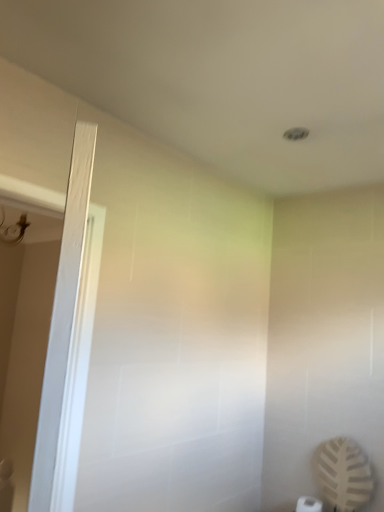
Question: Do you think white wood screen door at left is within white matte toilet paper at lower right, or outside of it?

Choices:
 (A) inside
 (B) outside

Answer: (B)

Question: Does point (44, 486) appear closer or farther from the camera than point (314, 499)?

Choices:
 (A) farther
 (B) closer

Answer: (B)

Question: Is white wood screen door at left taller or shorter than white matte toilet paper at lower right?

Choices:
 (A) tall
 (B) short

Answer: (A)

Question: Is white matte toilet paper at lower right to the left or to the right of white wood screen door at left in the image?

Choices:
 (A) right
 (B) left

Answer: (A)

Question: From a real-world perspective, is white matte toilet paper at lower right positioned above or below white wood screen door at left?

Choices:
 (A) below
 (B) above

Answer: (A)

Question: Considering the positions of point (311, 509) and point (64, 385), is point (311, 509) closer or farther from the camera than point (64, 385)?

Choices:
 (A) farther
 (B) closer

Answer: (A)

Question: Considering the positions of white matte toilet paper at lower right and white wood screen door at left in the image, is white matte toilet paper at lower right taller or shorter than white wood screen door at left?

Choices:
 (A) short
 (B) tall

Answer: (A)